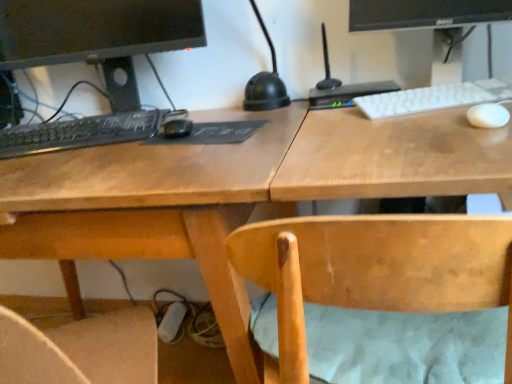
The image size is (512, 384). In order to click on free space in front of white matte mouse at upper right in this screenshot , I will do `click(476, 144)`.